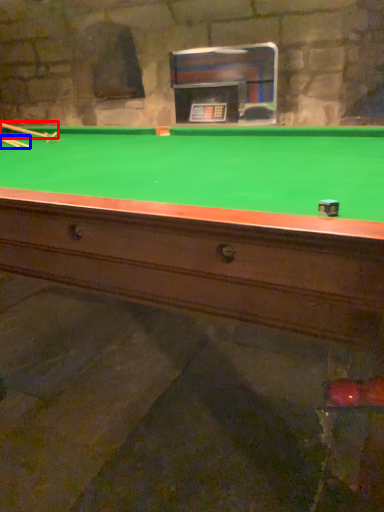
Question: Which point is further to the camera, cue (highlighted by a red box) or cue (highlighted by a blue box)?

Choices:
 (A) cue
 (B) cue

Answer: (A)